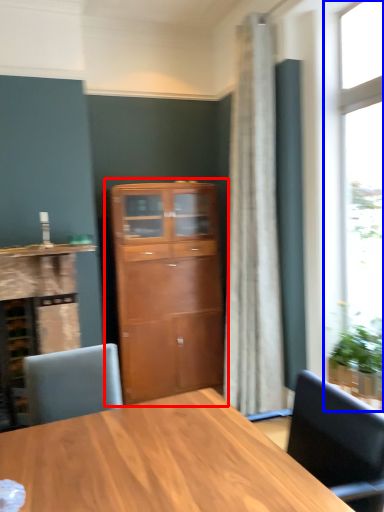
Question: Which object appears closest to the camera in this image, cupboard (highlighted by a red box) or window (highlighted by a blue box)?

Choices:
 (A) cupboard
 (B) window

Answer: (B)